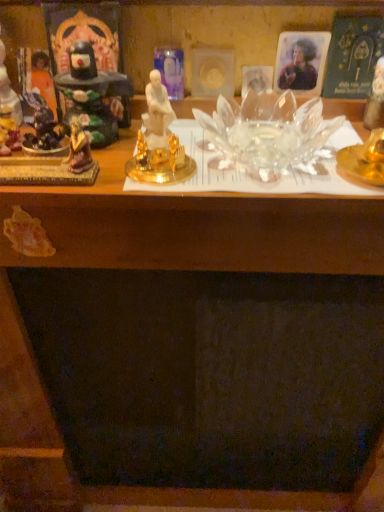
Question: Is matte black statue at left, which is the 4th toy from right to left, further to the viewer compared to matte black statue at left, which is counted as the third toy, starting from the left?

Choices:
 (A) yes
 (B) no

Answer: (B)

Question: Are matte black statue at left, which is the 4th toy from right to left, and matte black statue at left, which is counted as the third toy, starting from the left, far apart?

Choices:
 (A) yes
 (B) no

Answer: (B)

Question: Is matte black statue at left, which is the 1th toy in left-to-right order, next to matte black statue at left, the 2th toy when ordered from right to left, and touching it?

Choices:
 (A) yes
 (B) no

Answer: (B)

Question: From the image's perspective, is matte black statue at left, which is the 1th toy in left-to-right order, on matte black statue at left, the 2th toy when ordered from right to left?

Choices:
 (A) yes
 (B) no

Answer: (A)

Question: From the image's perspective, would you say matte black statue at left, which is the 4th toy from right to left, is shown under matte black statue at left, which is counted as the third toy, starting from the left?

Choices:
 (A) no
 (B) yes

Answer: (A)

Question: Considering the positions of transparent glass candle at upper right, acting as the 1th toy starting from the right, and matte plastic photo at upper right, which is the first person from right to left, in the image, is transparent glass candle at upper right, acting as the 1th toy starting from the right, wider or thinner than matte plastic photo at upper right, which is the first person from right to left,?

Choices:
 (A) wide
 (B) thin

Answer: (A)

Question: From the image's perspective, is transparent glass candle at upper right, the fourth toy positioned from the left, above or below matte plastic photo at upper right, positioned as the second person in left-to-right order?

Choices:
 (A) above
 (B) below

Answer: (B)

Question: Is point (382, 112) positioned closer to the camera than point (299, 79)?

Choices:
 (A) closer
 (B) farther

Answer: (A)

Question: In terms of height, does transparent glass candle at upper right, the fourth toy positioned from the left, look taller or shorter compared to matte plastic photo at upper right, positioned as the second person in left-to-right order?

Choices:
 (A) tall
 (B) short

Answer: (A)

Question: Choose the correct answer: Is matte black statue at left, which is counted as the third toy, starting from the left, inside matte black statue at left, which is the 1th toy in left-to-right order, or outside it?

Choices:
 (A) outside
 (B) inside

Answer: (A)

Question: Is matte black statue at left, the 2th toy when ordered from right to left, to the left or to the right of matte black statue at left, which is the 4th toy from right to left, in the image?

Choices:
 (A) left
 (B) right

Answer: (B)

Question: From a real-world perspective, is matte black statue at left, which is counted as the third toy, starting from the left, physically located above or below matte black statue at left, which is the 4th toy from right to left?

Choices:
 (A) above
 (B) below

Answer: (B)

Question: Relative to matte black statue at left, which is the 4th toy from right to left, is matte black statue at left, which is counted as the third toy, starting from the left, in front or behind?

Choices:
 (A) behind
 (B) front

Answer: (A)

Question: Is orange fabric statue at left, which ranks as the 1th person in left-to-right order, spatially inside transparent glass bowl at center, or outside of it?

Choices:
 (A) outside
 (B) inside

Answer: (A)

Question: Does point (33, 56) appear closer or farther from the camera than point (61, 264)?

Choices:
 (A) farther
 (B) closer

Answer: (B)